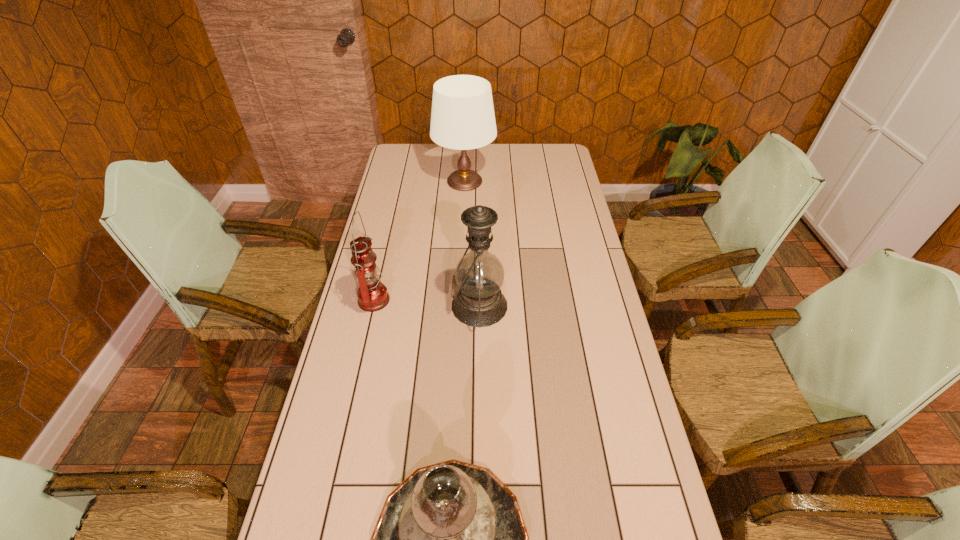
You are a GUI agent. You are given a task and a screenshot of the screen. Output one action in this format:
    pyautogui.click(x=<x>, y=<y>)
    Task: Click on the farthest object
    The image size is (960, 540).
    Given the screenshot: What is the action you would take?
    pyautogui.click(x=462, y=118)

This screenshot has width=960, height=540. In order to click on the leftmost object in this screenshot , I will do `click(372, 294)`.

Identify the location of vacant space located 0.100m on the back of the lamp. (466, 154).

Identify the location of vacant space located 0.200m on the right of the leftmost object. This screenshot has width=960, height=540. (448, 301).

I want to click on object located in the far edge section of the desktop, so click(462, 118).

At what (x,y) coordinates should I click in order to perform the action: click on object positioned at the left edge. Please return your answer as a coordinate pair (x, y). Looking at the image, I should click on (372, 294).

Locate an element on the screen. Image resolution: width=960 pixels, height=540 pixels. vacant region at the far edge of the desktop is located at coordinates (490, 148).

Where is `vacant area at the left edge`? vacant area at the left edge is located at coordinates (412, 169).

Image resolution: width=960 pixels, height=540 pixels. What are the coordinates of `vacant area at the right edge` in the screenshot? It's located at (542, 197).

Where is `vacant region at the far right corner of the desktop`? This screenshot has width=960, height=540. vacant region at the far right corner of the desktop is located at coordinates (543, 168).